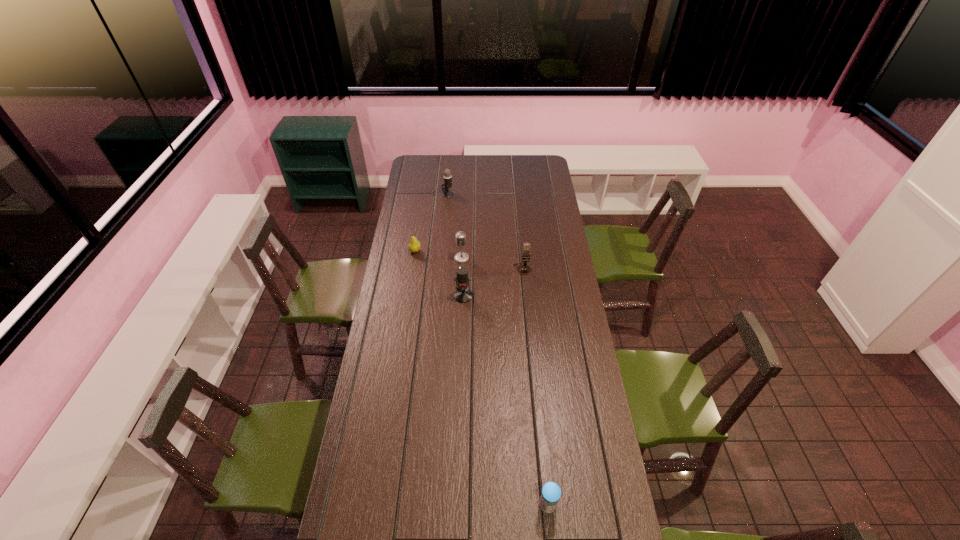
The width and height of the screenshot is (960, 540). What are the coordinates of `vacant space located on the back of the nearest object` in the screenshot? It's located at (543, 459).

The image size is (960, 540). Identify the location of object located in the left edge section of the desktop. (414, 246).

The height and width of the screenshot is (540, 960). In order to click on vacant area at the far edge of the desktop in this screenshot , I will do `click(468, 159)`.

Identify the location of vacant space at the left edge. The width and height of the screenshot is (960, 540). (422, 204).

The width and height of the screenshot is (960, 540). What are the coordinates of `vacant space at the right edge of the desktop` in the screenshot? It's located at (569, 384).

You are a GUI agent. You are given a task and a screenshot of the screen. Output one action in this format:
    pyautogui.click(x=<x>, y=<y>)
    Task: Click on the free space between the leftmost microphone and the fifth farthest object
    This screenshot has width=960, height=540.
    Given the screenshot: What is the action you would take?
    pyautogui.click(x=455, y=245)

Identify the location of blank region between the fifth farthest object and the medicine. The width and height of the screenshot is (960, 540). (506, 400).

Image resolution: width=960 pixels, height=540 pixels. In order to click on vacant area that lies between the nearest microphone and the pear in this screenshot , I will do `click(439, 273)`.

Identify the location of free area in between the rightmost microphone and the second nearest object. This screenshot has width=960, height=540. (493, 282).

I want to click on empty space between the farthest object and the medicine, so click(x=497, y=349).